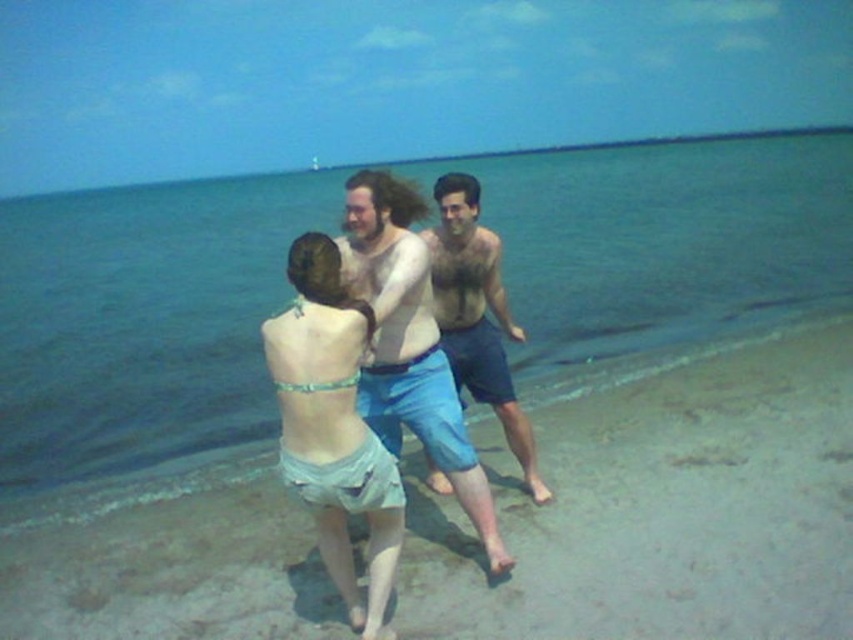
Which of these two, light blue fabric bikini top at center or light blue denim shorts at center, stands shorter?

With less height is light blue denim shorts at center.

From the picture: Which is more to the right, light blue fabric bikini top at center or light blue denim shorts at center?

light blue fabric bikini top at center

This screenshot has height=640, width=853. In order to click on light blue fabric bikini top at center in this screenshot , I will do `click(409, 342)`.

Is point (572, 474) less distant than point (132, 214)?

Yes.

The width and height of the screenshot is (853, 640). Describe the element at coordinates (660, 506) in the screenshot. I see `light brown sand at lower center` at that location.

Is point (144, 529) closer to camera compared to point (688, 307)?

Yes, it is.

This screenshot has width=853, height=640. Find the location of `light brown sand at lower center`. light brown sand at lower center is located at coordinates (660, 506).

Is point (207, 592) farther from viewer compared to point (442, 260)?

No, it is in front of (442, 260).

Between point (503, 488) and point (447, 241), which one is positioned in front?

Positioned in front is point (447, 241).

Locate an element on the screen. Image resolution: width=853 pixels, height=640 pixels. light brown sand at lower center is located at coordinates (660, 506).